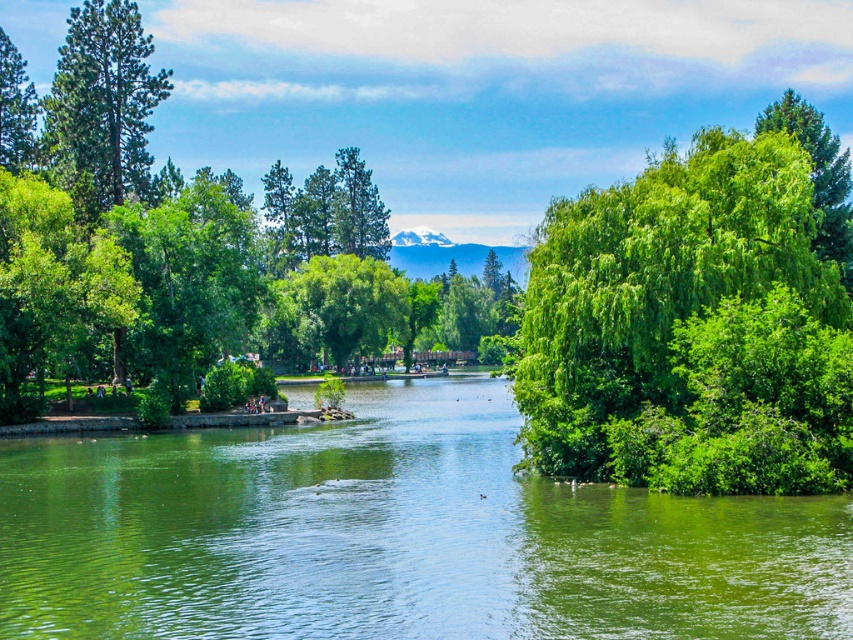
Between green textured tree at upper left and green leafy tree at center, which one appears on the left side from the viewer's perspective?

green textured tree at upper left

Does green textured tree at upper left appear on the left side of green leafy tree at center?

Correct, you'll find green textured tree at upper left to the left of green leafy tree at center.

Where is `green textured tree at upper left`? This screenshot has height=640, width=853. green textured tree at upper left is located at coordinates (102, 108).

Image resolution: width=853 pixels, height=640 pixels. I want to click on green textured tree at upper left, so click(x=102, y=108).

Does green leafy tree at right lie in front of green leafy tree at upper right?

Yes, green leafy tree at right is in front of green leafy tree at upper right.

Does point (590, 467) come behind point (825, 138)?

That is False.

This screenshot has width=853, height=640. I want to click on green leafy tree at right, so click(688, 324).

Is green leafy tree at center to the left of green leafy tree at upper right from the viewer's perspective?

Correct, you'll find green leafy tree at center to the left of green leafy tree at upper right.

The height and width of the screenshot is (640, 853). In order to click on green leafy tree at center in this screenshot , I will do `click(344, 305)`.